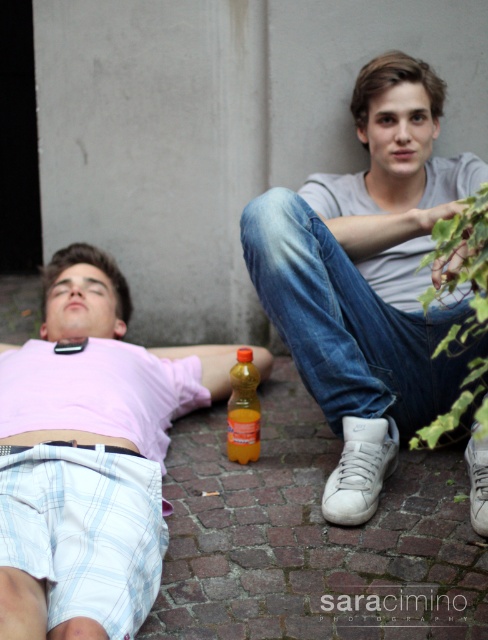
You are a delivery robot that needs to place a package between the white matte sneakers at lower right and the translucent orange bottle at center. Considering their heights, which object should you avoid placing the package near to ensure it doesn

The white matte sneakers at lower right has a greater height compared to the translucent orange bottle at center. To ensure the package is placed safely, avoid placing it near the white matte sneakers at lower right as it is taller and might knock over the package.

Looking at this image, you are a photographer trying to capture a candid shot of the two people in the scene. You notice the white matte sneakers at lower right and the white plaid shorts at lower left. Which object is covering part of the other?

The white matte sneakers at lower right is positioned over white plaid shorts at lower left, so the sneakers are covering part of the shorts.